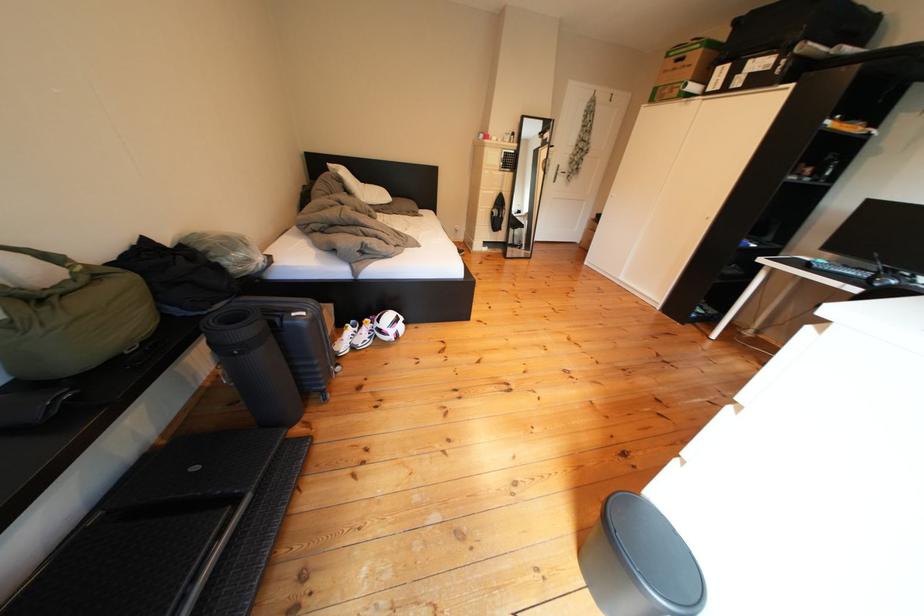
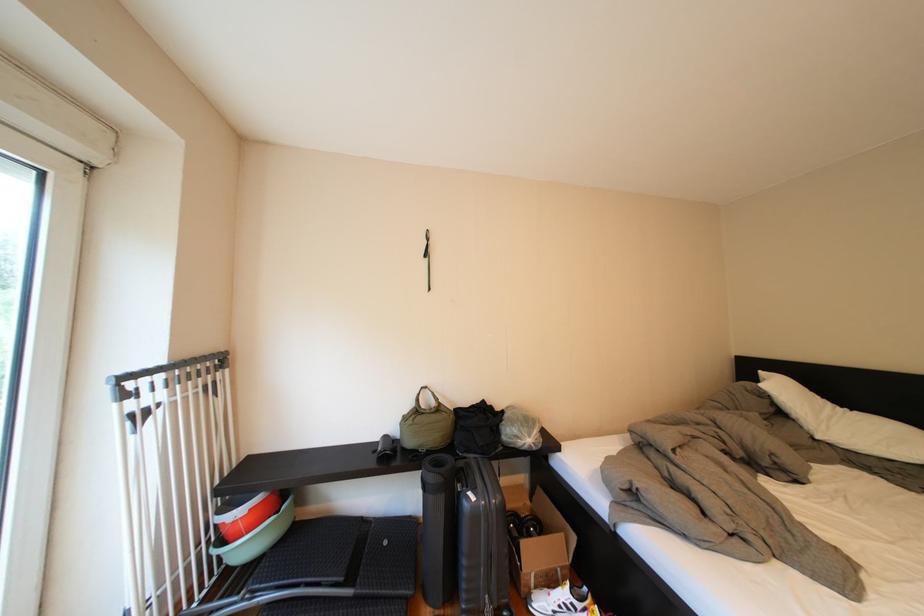
Question: I am providing you with two images of the same scene from different viewpoints. Please identify which objects are invisible in image2.

Choices:
 (A) suitcase handle
 (B) white pillow
 (C) cardboard box
 (D) none of these

Answer: (D)